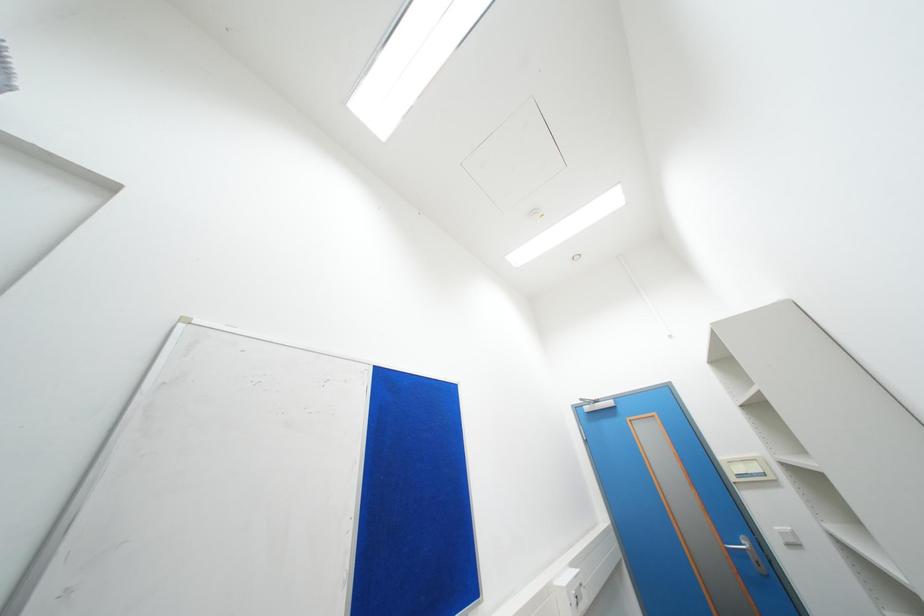
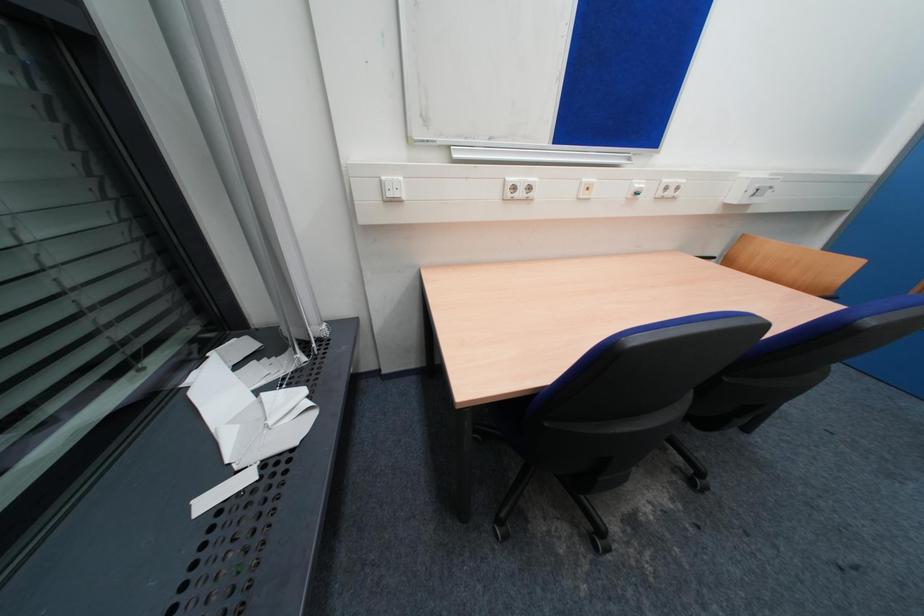
Looking at this image, first-person continuous shooting, in which direction is the camera rotating?

The camera rotated toward left-down.